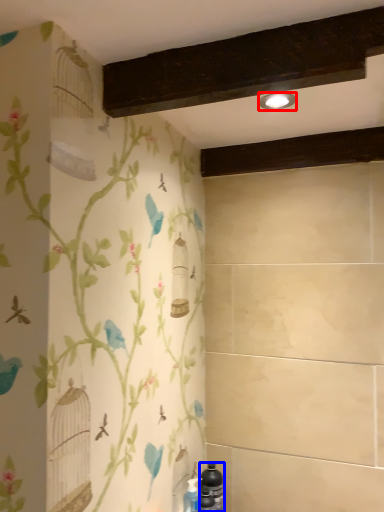
Question: Which object appears farthest to the camera in this image, light fixture (highlighted by a red box) or bottle (highlighted by a blue box)?

Choices:
 (A) light fixture
 (B) bottle

Answer: (B)